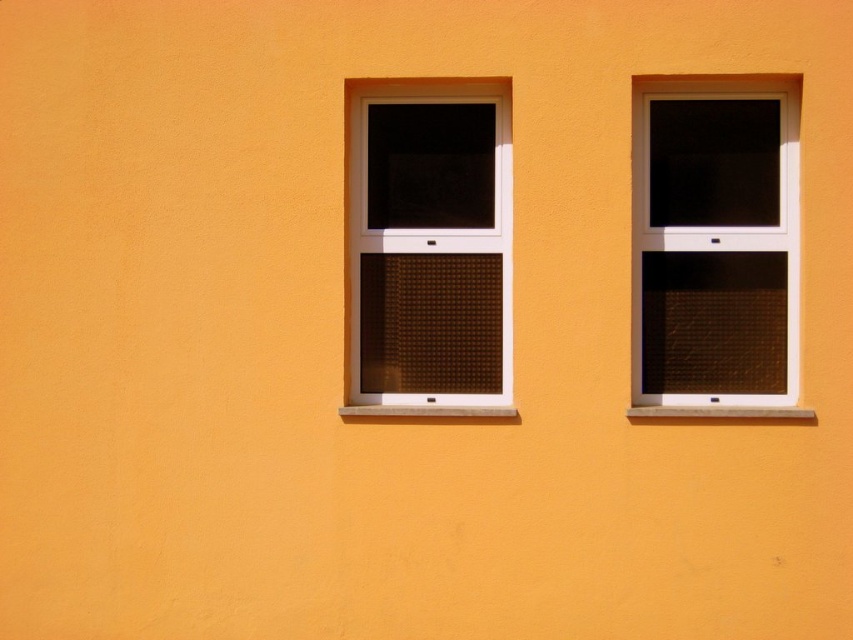
You are an interior designer assessing the wall with two windows. The matte white window at right and the brown textured glass at center are both on the same wall. Which window is wider?

The matte white window at right is wider than the brown textured glass at center because its width surpasses that of the brown textured glass at center.

You are standing in front of the orange wall and want to locate the matte white window at right and the brown textured glass at center. Which object is positioned to the right side of the other?

The matte white window at right is to the right of brown textured glass at center.